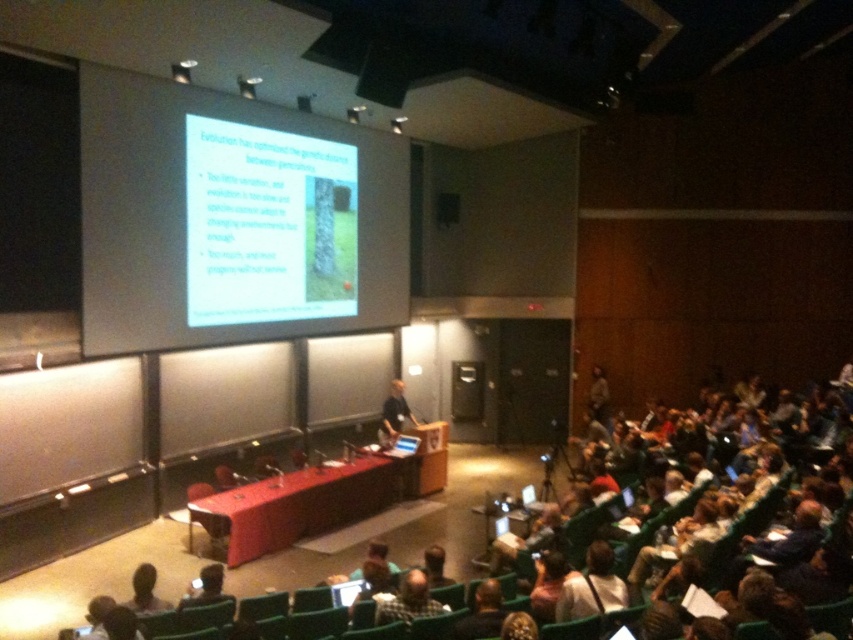
Between point (277, 285) and point (212, 582), which one is positioned in front?

Positioned in front is point (212, 582).

Between white matte projector screen at upper center and matte black laptop at lower left, which one appears on the left side from the viewer's perspective?

white matte projector screen at upper center is more to the left.

Where is `white matte projector screen at upper center`? The height and width of the screenshot is (640, 853). white matte projector screen at upper center is located at coordinates (267, 225).

Is matte white projector screen at upper center positioned behind white matte projector screen at upper center?

No.

In the scene shown: Does matte white projector screen at upper center appear over white matte projector screen at upper center?

Yes, matte white projector screen at upper center is above white matte projector screen at upper center.

Identify the location of matte white projector screen at upper center. (221, 221).

How much distance is there between matte white projector screen at upper center and dark hair at lower left?

matte white projector screen at upper center and dark hair at lower left are 17.69 feet apart.

Who is more forward, (143,337) or (160,609)?

Point (160,609)

This screenshot has width=853, height=640. I want to click on matte white projector screen at upper center, so click(x=221, y=221).